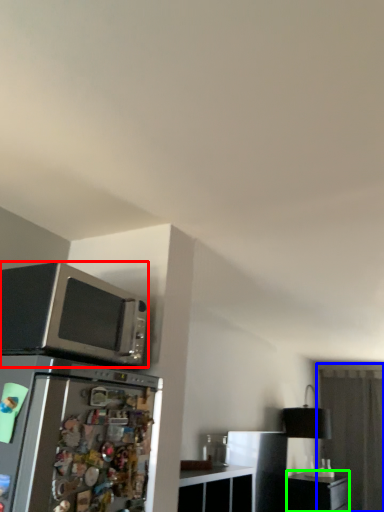
Question: Which is farther away from microwave oven (highlighted by a red box)? glass door (highlighted by a blue box) or file cabinet (highlighted by a green box)?

Choices:
 (A) glass door
 (B) file cabinet

Answer: (A)